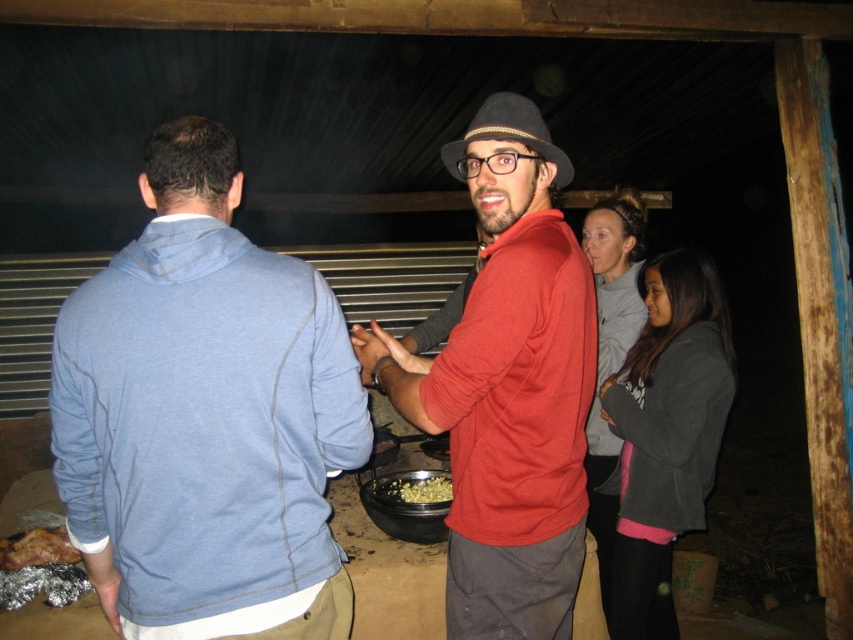
You are at a party and want to grab a snack. You see the blue fleece jacket at center and the yellow matte popcorn at center. Which one is bigger?

The blue fleece jacket at center is larger than the yellow matte popcorn at center.

Based on the photo, you are a delivery robot with a width of 1 meter. You need to move from the dark gray fleece jacket at right to the shiny silver foil at lower left. Is there enough space for you to pass through the path between them?

The distance between the dark gray fleece jacket at right and the shiny silver foil at lower left is 1.49 meters. Since the robot is 1 meter wide, there is sufficient space to pass through the path between them.